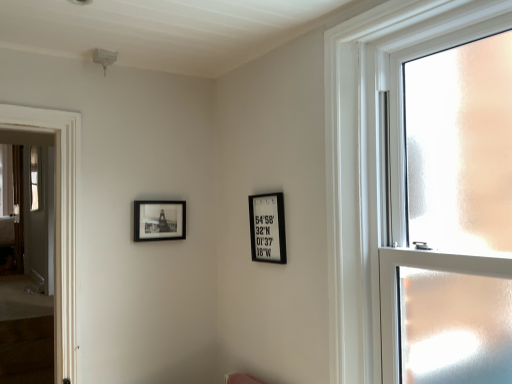
Looking at this image, what is the approximate width of black matte picture frame at upper center, the 2th picture frame viewed from the left?

It is 2.18 inches.

In order to face black matte picture frame at upper left, the second picture frame viewed from the right, should I rotate leftwards or rightwards?

A 12.644 degree turn to the left will do.

I want to click on black matte picture frame at upper center, the 2th picture frame viewed from the left, so click(x=267, y=228).

Is clear glass window at right inside or outside of black matte picture frame at upper left, the second picture frame viewed from the right?

clear glass window at right is not enclosed by black matte picture frame at upper left, the second picture frame viewed from the right.

Could you tell me if clear glass window at right is turned towards black matte picture frame at upper left, which ranks as the first picture frame in left-to-right order?

No, clear glass window at right is not facing towards black matte picture frame at upper left, which ranks as the first picture frame in left-to-right order.

Which is less distant, (344, 238) or (158, 227)?

The point (344, 238) is closer.

In the scene shown: Considering the sizes of clear glass window at right and black matte picture frame at upper left, which ranks as the first picture frame in left-to-right order, in the image, is clear glass window at right wider or thinner than black matte picture frame at upper left, which ranks as the first picture frame in left-to-right order,?

Considering their sizes, clear glass window at right looks broader than black matte picture frame at upper left, which ranks as the first picture frame in left-to-right order.

Is black matte picture frame at upper center, the 2th picture frame viewed from the left, positioned behind black matte picture frame at upper left, which ranks as the first picture frame in left-to-right order?

No, black matte picture frame at upper center, the 2th picture frame viewed from the left, is in front of black matte picture frame at upper left, which ranks as the first picture frame in left-to-right order.

Is black matte picture frame at upper center, the 2th picture frame viewed from the left, next to black matte picture frame at upper left, which ranks as the first picture frame in left-to-right order, and touching it?

No, black matte picture frame at upper center, the 2th picture frame viewed from the left, is not with black matte picture frame at upper left, which ranks as the first picture frame in left-to-right order.

This screenshot has width=512, height=384. I want to click on picture frame that appears on the left of black matte picture frame at upper center, positioned as the first picture frame in right-to-left order, so click(x=159, y=220).

Can we say black matte picture frame at upper left, the second picture frame viewed from the right, lies outside black matte picture frame at upper center, the 2th picture frame viewed from the left?

Yes.

Based on the photo, between black matte picture frame at upper left, which ranks as the first picture frame in left-to-right order, and black matte picture frame at upper center, the 2th picture frame viewed from the left, which one has larger size?

black matte picture frame at upper center, the 2th picture frame viewed from the left, is bigger.

From a real-world perspective, who is located higher, black matte picture frame at upper left, the second picture frame viewed from the right, or black matte picture frame at upper center, positioned as the first picture frame in right-to-left order?

black matte picture frame at upper left, the second picture frame viewed from the right, is physically above.

Is black matte picture frame at upper center, positioned as the first picture frame in right-to-left order, situated inside clear glass window at right or outside?

black matte picture frame at upper center, positioned as the first picture frame in right-to-left order, cannot be found inside clear glass window at right.

Is black matte picture frame at upper center, the 2th picture frame viewed from the left, to the left of clear glass window at right from the viewer's perspective?

Yes.

Find the location of a particular element. The width and height of the screenshot is (512, 384). the 1st picture frame behind the clear glass window at right is located at coordinates (267, 228).

Looking at this image, considering the sizes of black matte picture frame at upper left, which ranks as the first picture frame in left-to-right order, and clear glass window at right in the image, is black matte picture frame at upper left, which ranks as the first picture frame in left-to-right order, wider or thinner than clear glass window at right?

Considering their sizes, black matte picture frame at upper left, which ranks as the first picture frame in left-to-right order, looks slimmer than clear glass window at right.

Could you tell me if black matte picture frame at upper left, which ranks as the first picture frame in left-to-right order, is facing clear glass window at right?

Yes, black matte picture frame at upper left, which ranks as the first picture frame in left-to-right order, is facing clear glass window at right.

Measure the distance from black matte picture frame at upper left, which ranks as the first picture frame in left-to-right order, to clear glass window at right.

black matte picture frame at upper left, which ranks as the first picture frame in left-to-right order, is 1.06 meters away from clear glass window at right.

Is black matte picture frame at upper left, which ranks as the first picture frame in left-to-right order, far away from clear glass window at right?

Yes.

From a real-world perspective, who is located lower, clear glass window at right or black matte picture frame at upper center, the 2th picture frame viewed from the left?

black matte picture frame at upper center, the 2th picture frame viewed from the left.

Considering the sizes of objects clear glass window at right and black matte picture frame at upper center, positioned as the first picture frame in right-to-left order, in the image provided, who is shorter, clear glass window at right or black matte picture frame at upper center, positioned as the first picture frame in right-to-left order,?

black matte picture frame at upper center, positioned as the first picture frame in right-to-left order, is shorter.

Can you confirm if clear glass window at right is thinner than black matte picture frame at upper center, the 2th picture frame viewed from the left?

No, clear glass window at right is not thinner than black matte picture frame at upper center, the 2th picture frame viewed from the left.

You are a GUI agent. You are given a task and a screenshot of the screen. Output one action in this format:
    pyautogui.click(x=<x>, y=<y>)
    Task: Click on the window located above the black matte picture frame at upper left, the second picture frame viewed from the right (from the image's perspective)
    This screenshot has width=512, height=384.
    Given the screenshot: What is the action you would take?
    pyautogui.click(x=372, y=150)

The image size is (512, 384). Identify the location of picture frame lying in front of the black matte picture frame at upper left, which ranks as the first picture frame in left-to-right order. (267, 228).

When comparing their distances from clear glass window at right, does black matte picture frame at upper center, positioned as the first picture frame in right-to-left order, or black matte picture frame at upper left, the second picture frame viewed from the right, seem further?

black matte picture frame at upper left, the second picture frame viewed from the right, lies further to clear glass window at right than the other object.

From the image, which object appears to be farther from black matte picture frame at upper left, the second picture frame viewed from the right, clear glass window at right or black matte picture frame at upper center, positioned as the first picture frame in right-to-left order?

Among the two, clear glass window at right is located further to black matte picture frame at upper left, the second picture frame viewed from the right.

Considering their positions, is black matte picture frame at upper left, which ranks as the first picture frame in left-to-right order, positioned further to clear glass window at right than black matte picture frame at upper center, the 2th picture frame viewed from the left?

Based on the image, black matte picture frame at upper left, which ranks as the first picture frame in left-to-right order, appears to be further to clear glass window at right.

Considering their positions, is black matte picture frame at upper center, positioned as the first picture frame in right-to-left order, positioned closer to black matte picture frame at upper left, the second picture frame viewed from the right, than clear glass window at right?

black matte picture frame at upper center, positioned as the first picture frame in right-to-left order, is closer to black matte picture frame at upper left, the second picture frame viewed from the right.

When comparing their distances from black matte picture frame at upper center, positioned as the first picture frame in right-to-left order, does black matte picture frame at upper left, which ranks as the first picture frame in left-to-right order, or clear glass window at right seem closer?

clear glass window at right.

Looking at the image, which one is located closer to black matte picture frame at upper center, positioned as the first picture frame in right-to-left order, clear glass window at right or black matte picture frame at upper left, which ranks as the first picture frame in left-to-right order?

clear glass window at right is closer to black matte picture frame at upper center, positioned as the first picture frame in right-to-left order.

Locate an element on the screen. This screenshot has height=384, width=512. picture frame located between clear glass window at right and black matte picture frame at upper left, which ranks as the first picture frame in left-to-right order, in the depth direction is located at coordinates click(267, 228).